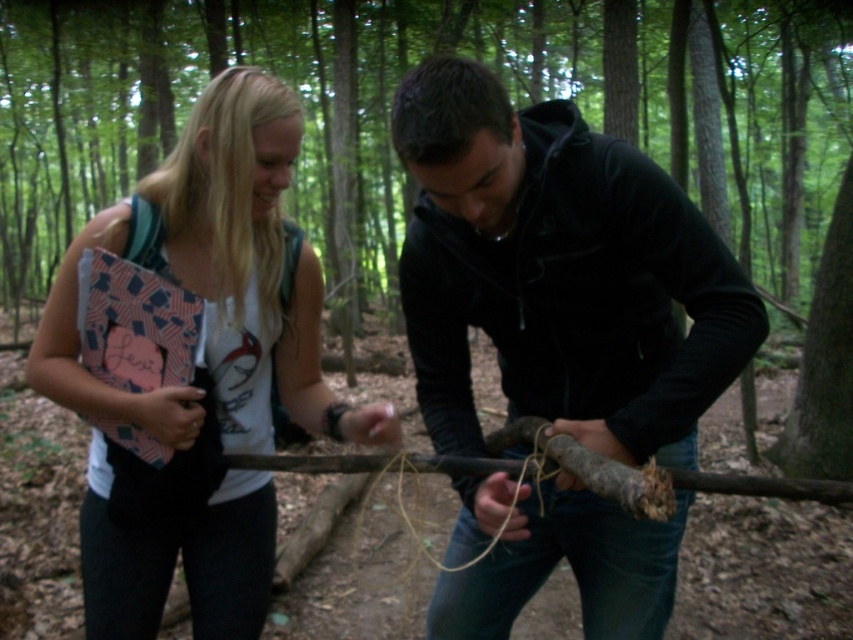
Question: Does black matte stick at center appear under matte pink notebook at left?

Choices:
 (A) no
 (B) yes

Answer: (B)

Question: Which object is the closest to the brown wood log at center?

Choices:
 (A) black matte stick at center
 (B) matte pink notebook at left

Answer: (A)

Question: Considering the relative positions of black matte stick at center and matte pink notebook at left in the image provided, where is black matte stick at center located with respect to matte pink notebook at left?

Choices:
 (A) below
 (B) above

Answer: (A)

Question: Does black matte stick at center have a lesser width compared to matte pink notebook at left?

Choices:
 (A) yes
 (B) no

Answer: (A)

Question: Among these objects, which one is nearest to the camera?

Choices:
 (A) black matte stick at center
 (B) matte pink notebook at left

Answer: (A)

Question: Which of the following is the closest to the observer?

Choices:
 (A) black matte stick at center
 (B) matte pink notebook at left

Answer: (A)